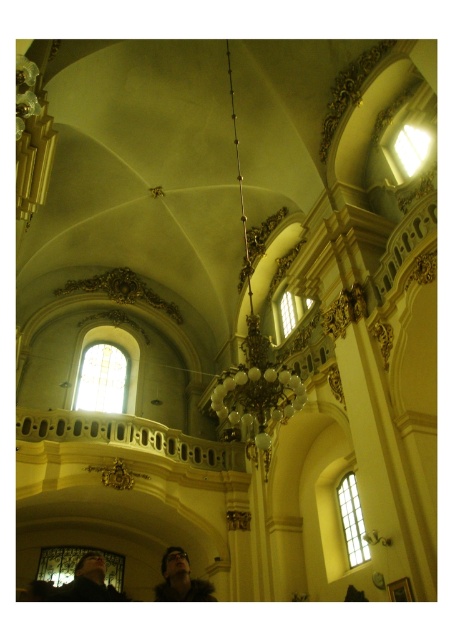
In the scene shown: You are a photographer planning to take a portrait of a person standing in this grand cathedral. You notice the dark brown hair at lower center and the dark brown leather jacket at lower left. Which object is narrower when viewed from your current position?

The dark brown hair at lower center is narrower than the dark brown leather jacket at lower left.

You are standing in the grand cathedral and notice two items at the front of the room. You see the dark brown hair at lower center and the dark brown leather jacket at lower left. Which item is closer to you?

The dark brown hair at lower center is closer to you because the dark brown leather jacket at lower left is behind it.

You are an interior designer assessing the space for a photoshoot. You need to position a model with dark brown hair at lower center and a model wearing a dark brown leather jacket at lower left. Based on the scene description, which object is taller?

The dark brown hair at lower center is taller than the dark brown leather jacket at lower left according to the description.